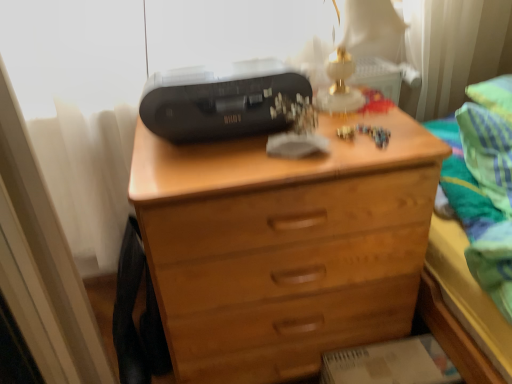
Question: Is wooden chest of drawers at center thinner than black plastic printer at upper center?

Choices:
 (A) no
 (B) yes

Answer: (A)

Question: From the image's perspective, is wooden chest of drawers at center located above black plastic printer at upper center?

Choices:
 (A) no
 (B) yes

Answer: (A)

Question: Is black plastic printer at upper center completely or partially inside wooden chest of drawers at center?

Choices:
 (A) yes
 (B) no

Answer: (B)

Question: Is wooden chest of drawers at center directly adjacent to black plastic printer at upper center?

Choices:
 (A) yes
 (B) no

Answer: (B)

Question: Considering the relative sizes of wooden chest of drawers at center and black plastic printer at upper center in the image provided, is wooden chest of drawers at center smaller than black plastic printer at upper center?

Choices:
 (A) yes
 (B) no

Answer: (B)

Question: From their relative heights in the image, would you say black plastic printer at upper center is taller or shorter than wooden chest of drawers at center?

Choices:
 (A) short
 (B) tall

Answer: (A)

Question: Looking at the image, does black plastic printer at upper center seem bigger or smaller compared to wooden chest of drawers at center?

Choices:
 (A) small
 (B) big

Answer: (A)

Question: Is black plastic printer at upper center to the left or to the right of wooden chest of drawers at center in the image?

Choices:
 (A) left
 (B) right

Answer: (A)

Question: Is black plastic printer at upper center wider or thinner than wooden chest of drawers at center?

Choices:
 (A) wide
 (B) thin

Answer: (B)

Question: Visually, is wooden chest of drawers at center positioned to the left or to the right of black plastic printer at upper center?

Choices:
 (A) left
 (B) right

Answer: (B)

Question: In terms of size, does wooden chest of drawers at center appear bigger or smaller than black plastic printer at upper center?

Choices:
 (A) big
 (B) small

Answer: (A)

Question: Considering the positions of wooden chest of drawers at center and black plastic printer at upper center in the image, is wooden chest of drawers at center taller or shorter than black plastic printer at upper center?

Choices:
 (A) tall
 (B) short

Answer: (A)

Question: Is wooden chest of drawers at center wider or thinner than black plastic printer at upper center?

Choices:
 (A) wide
 (B) thin

Answer: (A)

Question: Considering the relative positions of black plastic printer at upper center and green striped fabric at upper right in the image provided, is black plastic printer at upper center to the left or to the right of green striped fabric at upper right?

Choices:
 (A) right
 (B) left

Answer: (B)

Question: In terms of size, does black plastic printer at upper center appear bigger or smaller than green striped fabric at upper right?

Choices:
 (A) big
 (B) small

Answer: (B)